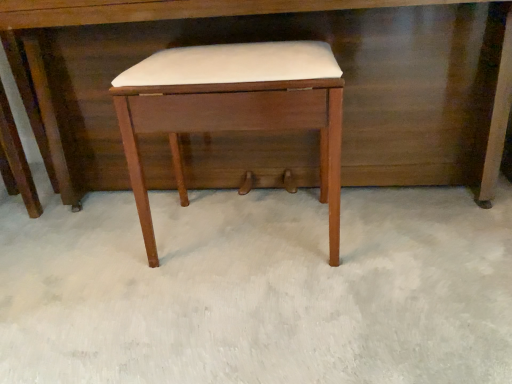
Find the location of a particular element. vacant space that is in between white leather stool at center and wooden desk at center is located at coordinates (280, 246).